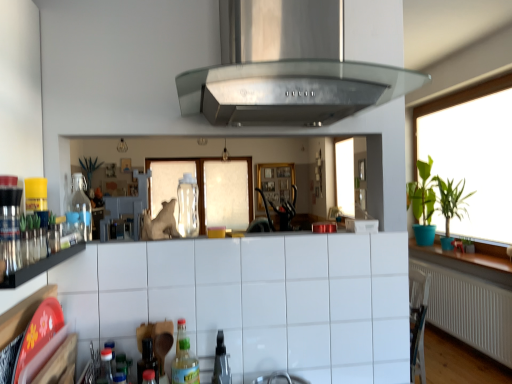
What do you see at coordinates (467, 242) in the screenshot?
I see `green leafy plant at right, which is counted as the 1th plant, starting from the back` at bounding box center [467, 242].

This screenshot has width=512, height=384. I want to click on green leafy plant at right, positioned as the 2th plant in front-to-back order, so click(467, 242).

Measure the distance between green matte plant at right, positioned as the second plant in back-to-front order, and camera.

4.18 meters.

What is the approximate height of black glass shelf at left?

black glass shelf at left is 2.93 inches tall.

Describe the element at coordinates (40, 266) in the screenshot. This screenshot has width=512, height=384. I see `black glass shelf at left` at that location.

This screenshot has width=512, height=384. I want to click on green leafy plant at right, positioned as the 2th plant in front-to-back order, so click(x=467, y=242).

Is the depth of translucent plastic bottle at lower center, placed as the 1th bottle when sorted from bottom to top, less than that of white matte radiator at lower right?

Yes.

Can you tell me how much translucent plastic bottle at lower center, arranged as the third bottle when viewed from the left, and white matte radiator at lower right differ in facing direction?

87.7 degrees separate the facing orientations of translucent plastic bottle at lower center, arranged as the third bottle when viewed from the left, and white matte radiator at lower right.

Considering the sizes of objects translucent plastic bottle at lower center, placed as the 1th bottle when sorted from bottom to top, and white matte radiator at lower right in the image provided, who is taller, translucent plastic bottle at lower center, placed as the 1th bottle when sorted from bottom to top, or white matte radiator at lower right?

With more height is white matte radiator at lower right.

How many degrees apart are the facing directions of black glass shelf at left and green leafy plant at right, which is counted as the 1th plant, starting from the back?

There is a 179-degree angle between the facing directions of black glass shelf at left and green leafy plant at right, which is counted as the 1th plant, starting from the back.

Could you measure the distance between black glass shelf at left and green leafy plant at right, positioned as the 2th plant in front-to-back order?

black glass shelf at left is 3.98 meters from green leafy plant at right, positioned as the 2th plant in front-to-back order.

Consider the image. Is black glass shelf at left facing towards green leafy plant at right, which is counted as the 1th plant, starting from the back?

No, black glass shelf at left does not turn towards green leafy plant at right, which is counted as the 1th plant, starting from the back.

Is black glass shelf at left bigger or smaller than green leafy plant at right, positioned as the 2th plant in front-to-back order?

black glass shelf at left is bigger than green leafy plant at right, positioned as the 2th plant in front-to-back order.

From a real-world perspective, between green leafy plant at right and green matte plant at right, positioned as the first plant in front-to-back order, who is vertically higher?

From a 3D spatial view, green leafy plant at right is above.

Which of these two, green leafy plant at right or green matte plant at right, positioned as the second plant in back-to-front order, stands shorter?

Standing shorter between the two is green matte plant at right, positioned as the second plant in back-to-front order.

Considering the relative positions of green leafy plant at right and green matte plant at right, positioned as the second plant in back-to-front order, in the image provided, is green leafy plant at right in front of green matte plant at right, positioned as the second plant in back-to-front order,?

Yes, green leafy plant at right is closer to the viewer.

Can you confirm if white glossy wood at right is shorter than clear plastic spray bottle at center?

Yes.

Which object is closer to the camera taking this photo, white glossy wood at right or clear plastic spray bottle at center?

Positioned in front is clear plastic spray bottle at center.

Considering the relative positions of white glossy wood at right and clear plastic spray bottle at center in the image provided, is white glossy wood at right to the right of clear plastic spray bottle at center from the viewer's perspective?

Yes.

From the image's perspective, is white glossy wood at right located beneath clear plastic spray bottle at center?

Yes, from the image's perspective, white glossy wood at right is beneath clear plastic spray bottle at center.

Which object is closer to the camera, white glossy wood at right or black glass shelf at left?

black glass shelf at left is in front.

How different are the orientations of white glossy wood at right and black glass shelf at left in degrees?

white glossy wood at right and black glass shelf at left are facing 179 degrees away from each other.

From a real-world perspective, which object rests below the other?

In real-world perspective, white glossy wood at right is lower.

Between white glossy wood at right and black glass shelf at left, which one has smaller size?

Smaller between the two is black glass shelf at left.

Is transparent glass bottle at center, which is the 3th bottle from bottom to top, further to camera compared to clear glass bottle at left, the 2th bottle viewed from the back?

That is True.

Does transparent glass bottle at center, which is the 2th bottle in right-to-left order, have a greater width compared to clear glass bottle at left, the first bottle from the left?

Correct, the width of transparent glass bottle at center, which is the 2th bottle in right-to-left order, exceeds that of clear glass bottle at left, the first bottle from the left.

Is there a large distance between transparent glass bottle at center, which is counted as the first bottle, starting from the top, and clear glass bottle at left, the 2th bottle viewed from the back?

transparent glass bottle at center, which is counted as the first bottle, starting from the top, is near clear glass bottle at left, the 2th bottle viewed from the back, not far away.

Between point (191, 233) and point (89, 214), which one is positioned in front?

The point (89, 214) is more forward.

Is stainless steel exhaust hood at center at the back of translucent plastic bottle at lower center, which is the 1th bottle from right to left?

translucent plastic bottle at lower center, which is the 1th bottle from right to left, is not turned away from stainless steel exhaust hood at center.

Considering the sizes of objects translucent plastic bottle at lower center, the third bottle from the back, and stainless steel exhaust hood at center in the image provided, who is shorter, translucent plastic bottle at lower center, the third bottle from the back, or stainless steel exhaust hood at center?

Standing shorter between the two is translucent plastic bottle at lower center, the third bottle from the back.

How far apart are translucent plastic bottle at lower center, which is the first bottle from front to back, and stainless steel exhaust hood at center?

translucent plastic bottle at lower center, which is the first bottle from front to back, and stainless steel exhaust hood at center are 34.01 inches apart from each other.

Find the location of a particular element. radiator on the right of the translucent plastic bottle at lower center, arranged as the third bottle when viewed from the left is located at coordinates (470, 310).

From a real-world perspective, which plant is the 2nd one underneath the black glass shelf at left? Please provide its 2D coordinates.

[(467, 242)]

Looking at the image, which one is located closer to green leafy plant at right, translucent plastic bottle at lower center, the third bottle from the back, or clear plastic spray bottle at center?

clear plastic spray bottle at center is closer to green leafy plant at right.

Which object lies further to the anchor point green leafy plant at right, positioned as the 2th plant in front-to-back order, white tile cabinetry at lower center or green leafy plant at right?

white tile cabinetry at lower center is positioned further to the anchor green leafy plant at right, positioned as the 2th plant in front-to-back order.

Looking at this image, which object lies nearer to the anchor point clear plastic spray bottle at center, stainless steel exhaust hood at center or white matte radiator at lower right?

Among the two, stainless steel exhaust hood at center is located nearer to clear plastic spray bottle at center.

Estimate the real-world distances between objects in this image. Which object is closer to green matte plant at right, positioned as the second plant in back-to-front order, green leafy plant at right or transparent glass bottle at center, marked as the 3th bottle in a front-to-back arrangement?

green leafy plant at right lies closer to green matte plant at right, positioned as the second plant in back-to-front order, than the other object.

Which object lies further to the anchor point green matte plant at right, positioned as the second plant in back-to-front order, translucent plastic bottle at lower center, which is the first bottle from front to back, or white tile cabinetry at lower center?

translucent plastic bottle at lower center, which is the first bottle from front to back.

Considering their positions, is clear plastic spray bottle at center positioned further to transparent glass bottle at center, marked as the 3th bottle in a front-to-back arrangement, than green leafy plant at right, which is counted as the 1th plant, starting from the back?

Among the two, green leafy plant at right, which is counted as the 1th plant, starting from the back, is located further to transparent glass bottle at center, marked as the 3th bottle in a front-to-back arrangement.

Which object lies further to the anchor point transparent glass bottle at center, marked as the 1th bottle in a back-to-front arrangement, green matte plant at right, positioned as the first plant in front-to-back order, or green leafy plant at right?

Based on the image, green matte plant at right, positioned as the first plant in front-to-back order, appears to be further to transparent glass bottle at center, marked as the 1th bottle in a back-to-front arrangement.

From the image, which object appears to be farther from white matte radiator at lower right, green matte plant at right, positioned as the first plant in front-to-back order, or white glossy wood at right?

The object further to white matte radiator at lower right is green matte plant at right, positioned as the first plant in front-to-back order.

The width and height of the screenshot is (512, 384). Identify the location of radiator located between translucent plastic bottle at lower center, arranged as the third bottle when viewed from the left, and green leafy plant at right in the left-right direction. (470, 310).

At what (x,y) coordinates should I click in order to perform the action: click on counter top between white matte radiator at lower right and green leafy plant at right, positioned as the 2th plant in front-to-back order, in the front-back direction. Please return your answer as a coordinate pair (x, y). Looking at the image, I should click on (466, 256).

What are the coordinates of `bottle between transparent glass bottle at center, which is the 2th bottle in right-to-left order, and clear plastic spray bottle at center, in the vertical direction` in the screenshot? It's located at (81, 203).

Locate an element on the screen. This screenshot has width=512, height=384. cabinetry positioned between black glass shelf at left and green leafy plant at right from near to far is located at coordinates (254, 301).